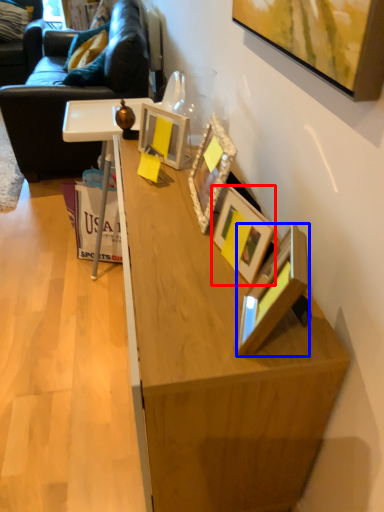
Question: Which of the following is the farthest to the observer, picture frame (highlighted by a red box) or picture frame (highlighted by a blue box)?

Choices:
 (A) picture frame
 (B) picture frame

Answer: (A)